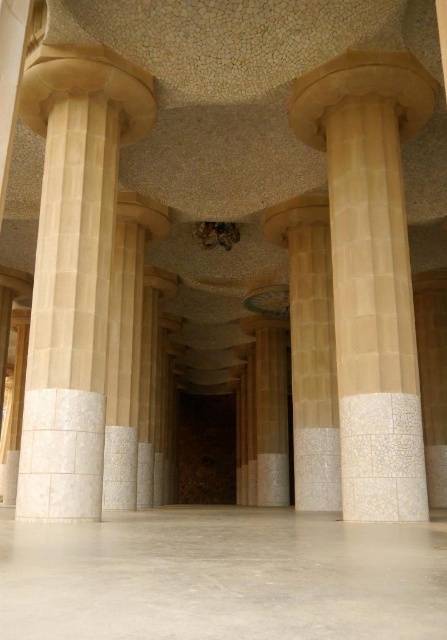
What are the coordinates of `beige marble column at center` in the screenshot? It's located at (371, 272).

Who is shorter, beige marble column at center or beige stone column at center?

beige marble column at center

Does point (391, 83) come in front of point (278, 220)?

Yes, point (391, 83) is in front of point (278, 220).

Locate an element on the screen. This screenshot has width=447, height=640. beige marble column at center is located at coordinates (371, 272).

Between beige stone column at left and beige stone column at center, which one appears on the right side from the viewer's perspective?

Positioned to the right is beige stone column at center.

Is beige stone column at left positioned before beige stone column at center?

Yes, it is in front of beige stone column at center.

Is point (63, 378) behind point (302, 451)?

No, it is not.

What are the coordinates of `beige stone column at left` in the screenshot? It's located at [72, 269].

Who is more distant from viewer, (396, 307) or (76, 472)?

The point (396, 307) is behind.

Which is behind, point (371, 333) or point (54, 301)?

The point (371, 333) is behind.

At what (x,y) coordinates should I click in order to perform the action: click on beige marble column at center. Please return your answer as a coordinate pair (x, y). Looking at the image, I should click on (371, 272).